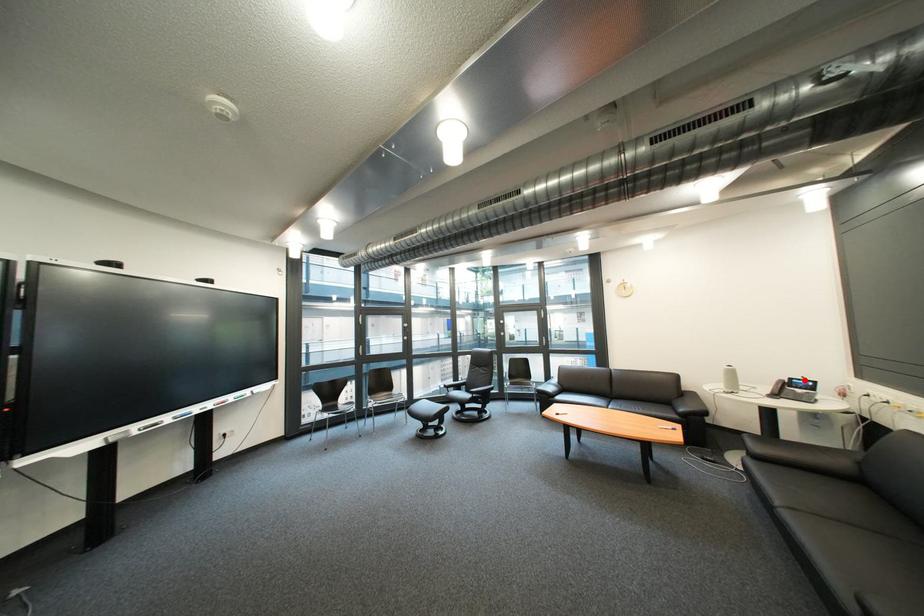
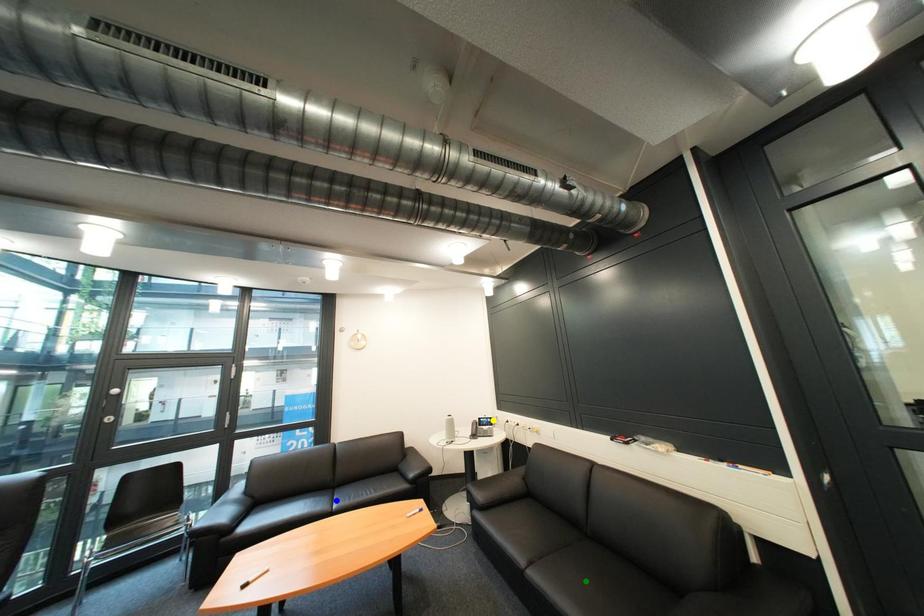
Question: I am providing you with two images of the same scene from different viewpoints. A red point is marked on the first image. You are given multiple points on the second image. Can you choose the point in image 2 that corresponds to the point in image 1?

Choices:
 (A) blue point
 (B) yellow point
 (C) green point

Answer: (B)